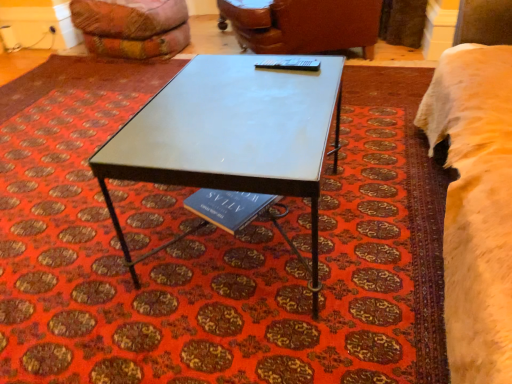
Question: Is point (159, 52) closer or farther from the camera than point (261, 61)?

Choices:
 (A) farther
 (B) closer

Answer: (A)

Question: Would you say velvet orange bean bag at upper left is to the left or to the right of metallic blue table tennis table at center in the picture?

Choices:
 (A) left
 (B) right

Answer: (A)

Question: Estimate the real-world distances between objects in this image. Which object is farther from the velvet orange bean bag at upper left?

Choices:
 (A) metallic gray table at center
 (B) metallic gray table at center
 (C) metallic blue table tennis table at center
 (D) fuzzy cream bed at right
 (E) leather couch at upper center

Answer: (D)

Question: Which is nearer to the velvet orange bean bag at upper left?

Choices:
 (A) fuzzy cream bed at right
 (B) metallic gray table at center
 (C) metallic gray table at center
 (D) metallic blue table tennis table at center
 (E) leather couch at upper center

Answer: (E)